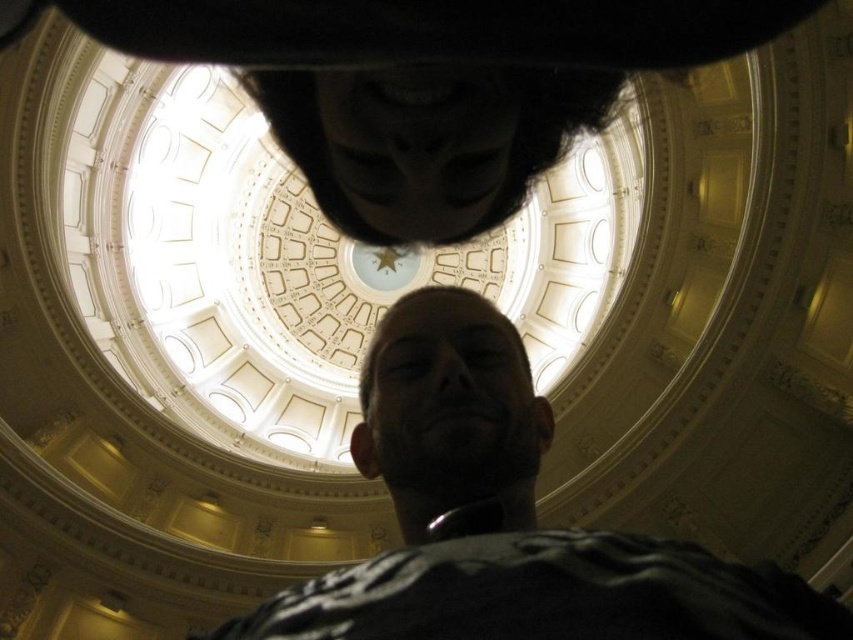
Is dark beard at center above black matte mask at upper center?

No, dark beard at center is not above black matte mask at upper center.

Who is positioned more to the right, dark beard at center or black matte mask at upper center?

From the viewer's perspective, dark beard at center appears more on the right side.

This screenshot has width=853, height=640. I want to click on dark beard at center, so click(505, 516).